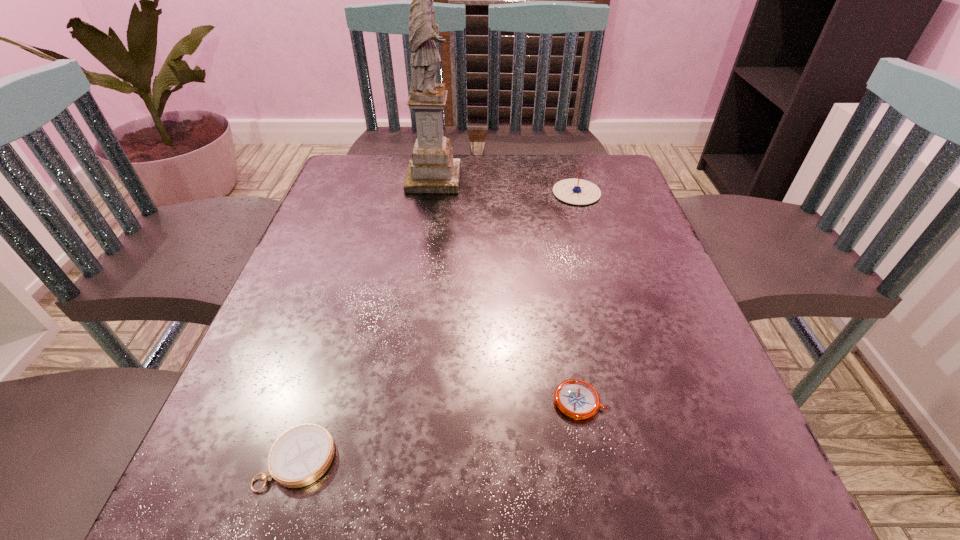
Locate an element on the screen. This screenshot has height=540, width=960. free space that satisfies the following two spatial constraints: 1. on the front-facing side of the third shortest object; 2. on the right side of the third object from right to left is located at coordinates (432, 193).

The height and width of the screenshot is (540, 960). I want to click on vacant area that satisfies the following two spatial constraints: 1. on the front-facing side of the sculpture; 2. on the front side of the leftmost object, so click(x=393, y=460).

Locate an element on the screen. free spot that satisfies the following two spatial constraints: 1. on the front-facing side of the second object from left to right; 2. on the right side of the shortest compass is located at coordinates (400, 401).